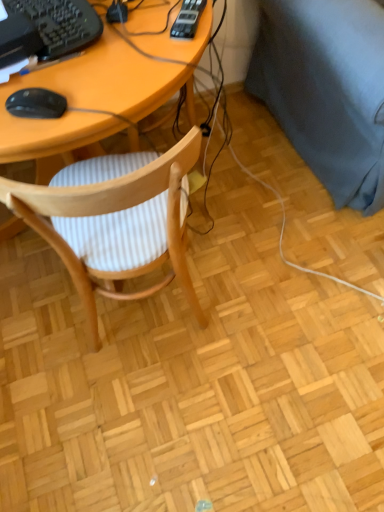
You are a GUI agent. You are given a task and a screenshot of the screen. Output one action in this format:
    pyautogui.click(x=<x>, y=<y>)
    Task: Click on the free location to the left of wooden chair with striped cushion at center
    
    Given the screenshot: What is the action you would take?
    pyautogui.click(x=42, y=322)